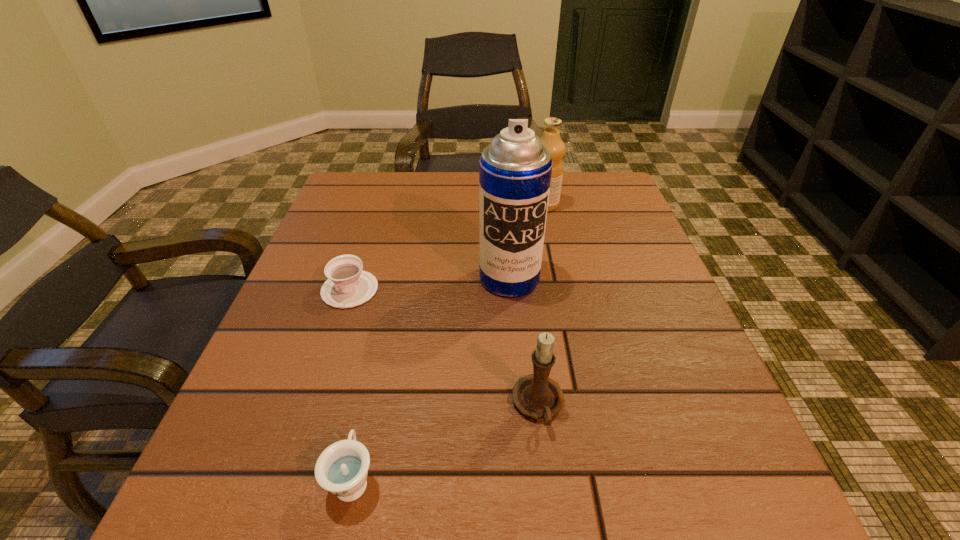
Locate an element on the screen. free spot located on the label of the farthest object is located at coordinates (442, 205).

The image size is (960, 540). In order to click on vacant space located 0.050m on the side of the second nearest object with the handle in this screenshot , I will do `click(546, 470)`.

At what (x,y) coordinates should I click in order to perform the action: click on free space located 0.360m on the side of the nearest object with the handle. Please return your answer as a coordinate pair (x, y). The height and width of the screenshot is (540, 960). Looking at the image, I should click on (396, 280).

What are the coordinates of `vacant space located on the side of the nearest object with the handle` in the screenshot? It's located at (396, 283).

This screenshot has height=540, width=960. I want to click on free space located 0.370m on the side of the nearest object with the handle, so click(x=396, y=276).

Where is `vacant space located 0.190m on the handle side of the farther teacup`? This screenshot has height=540, width=960. vacant space located 0.190m on the handle side of the farther teacup is located at coordinates [x=315, y=396].

Find the location of a particular element. object at the far edge is located at coordinates (551, 139).

Image resolution: width=960 pixels, height=540 pixels. I want to click on object that is at the near edge, so 342,468.

This screenshot has height=540, width=960. Find the location of `object that is at the left edge`. object that is at the left edge is located at coordinates (348, 285).

In the image, there is a desktop. At what (x,y) coordinates should I click in order to perform the action: click on blank space at the far edge. Please return your answer as a coordinate pair (x, y). This screenshot has height=540, width=960. Looking at the image, I should click on (451, 180).